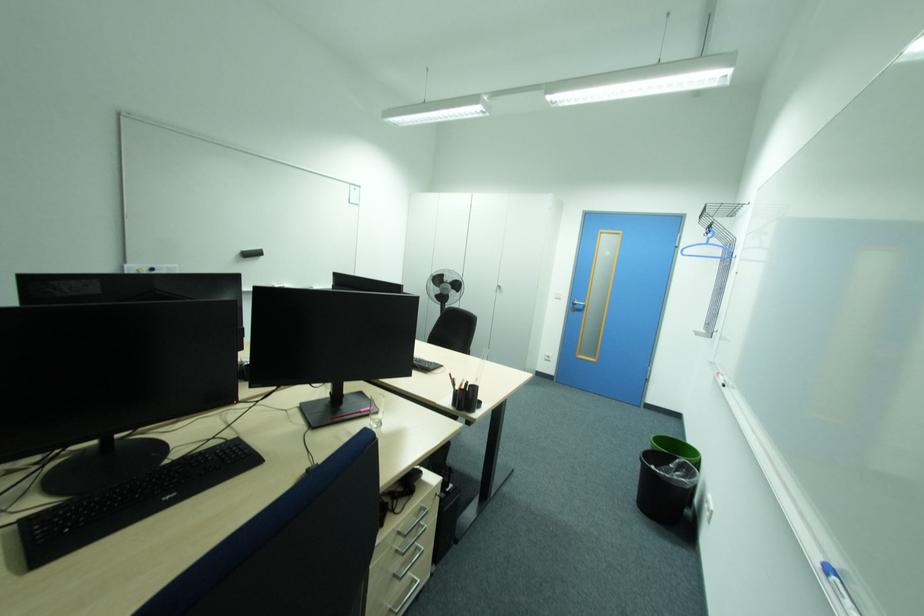
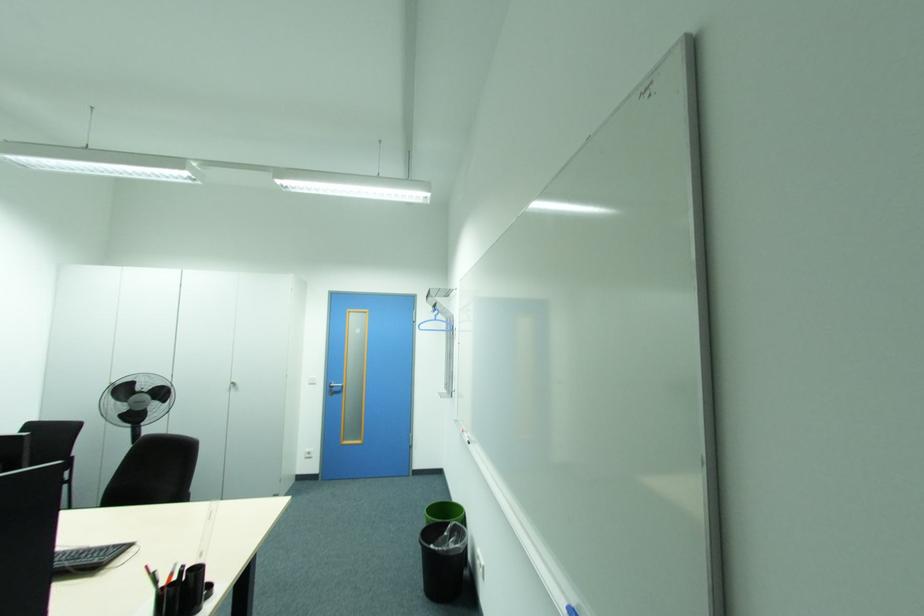
Question: The camera is either moving clockwise (left) or counter-clockwise (right) around the object. The first image is from the beginning of the video and the second image is from the end. Is the camera moving left or right when shooting the video?

Choices:
 (A) Left
 (B) Right

Answer: (A)